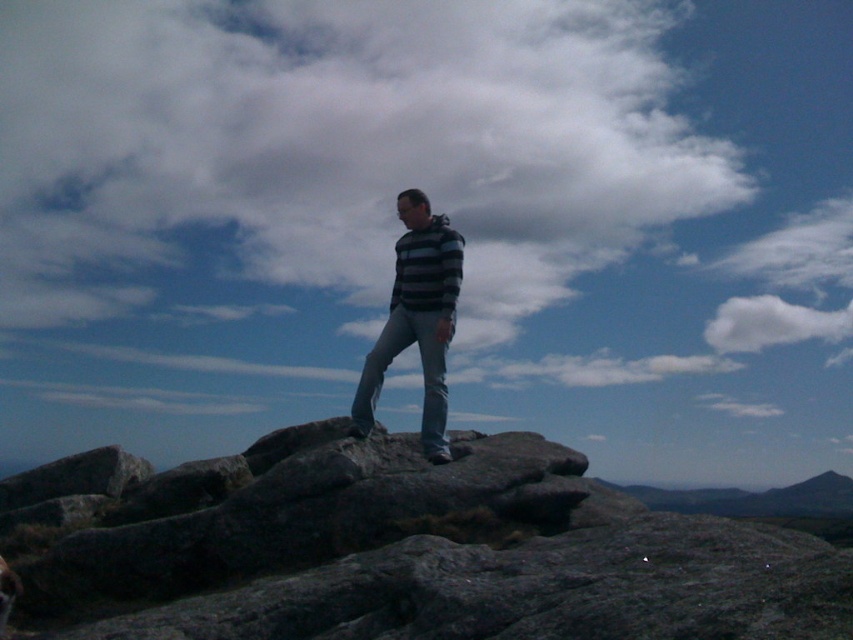
Question: Among these points, which one is nearest to the camera?

Choices:
 (A) (795, 564)
 (B) (434, 348)
 (C) (352, 419)
 (D) (840, 515)

Answer: (A)

Question: Estimate the real-world distances between objects in this image. Which object is farther from the gray rock formation at center?

Choices:
 (A) denim at center
 (B) white fluffy cloud at upper center
 (C) gray rock at center

Answer: (A)

Question: Considering the relative positions of denim at center and gray rock formation at center in the image provided, where is denim at center located with respect to gray rock formation at center?

Choices:
 (A) above
 (B) below

Answer: (A)

Question: Is gray rock at center behind gray rock formation at center?

Choices:
 (A) yes
 (B) no

Answer: (B)

Question: Can you confirm if gray rock at center is positioned above striped fabric at center?

Choices:
 (A) no
 (B) yes

Answer: (A)

Question: Which point is farther to the camera?

Choices:
 (A) gray rock at center
 (B) denim at center

Answer: (B)